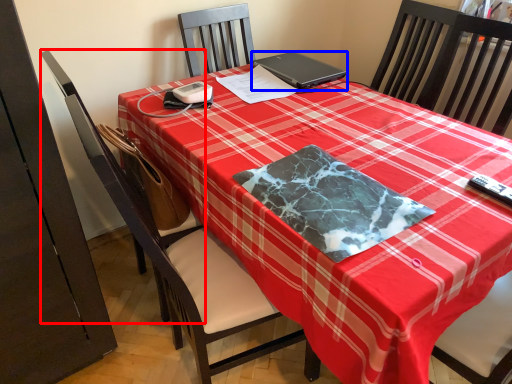
Question: Among these objects, which one is farthest to the camera, swivel chair (highlighted by a red box) or laptop (highlighted by a blue box)?

Choices:
 (A) swivel chair
 (B) laptop

Answer: (B)